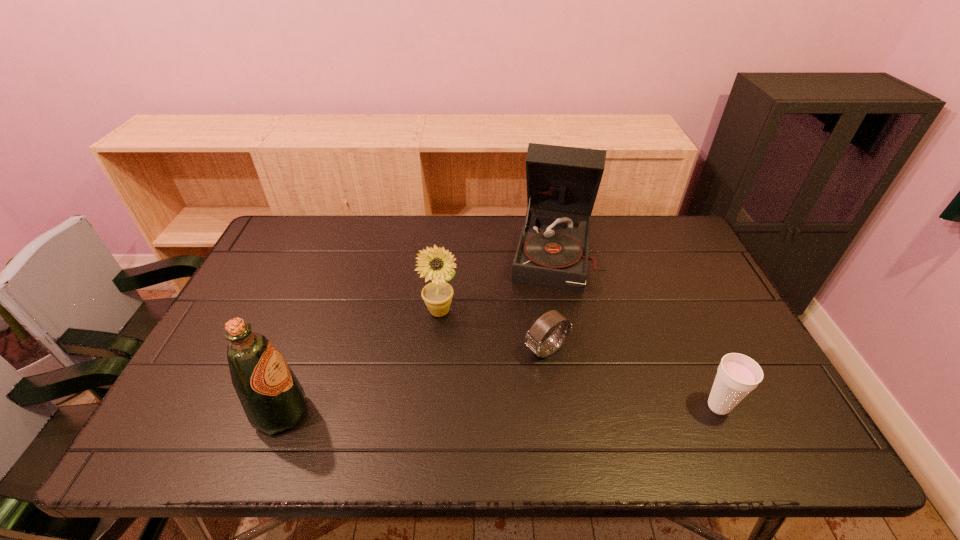
Find the location of `free space between the third nearest object and the leftmost object`. free space between the third nearest object and the leftmost object is located at coordinates (414, 381).

Where is `object that stands as the third closest to the third nearest object`? object that stands as the third closest to the third nearest object is located at coordinates (737, 375).

Identify the location of object that ranks as the third closest to the third tallest object. coord(273,399).

Find the location of a particular element. free space that satisfies the following two spatial constraints: 1. on the front side of the second shortest object; 2. on the left side of the sunflower is located at coordinates (431, 406).

You are a GUI agent. You are given a task and a screenshot of the screen. Output one action in this format:
    pyautogui.click(x=<x>, y=<y>)
    Task: Click on the vacant area in the image that satisfies the following two spatial constraints: 1. on the back side of the third tallest object; 2. on the left side of the tallest object
    This screenshot has width=960, height=540.
    Given the screenshot: What is the action you would take?
    pyautogui.click(x=445, y=251)

Where is `vacant space that satisfies the following two spatial constraints: 1. on the front side of the fourth tallest object; 2. on the right side of the watch`? vacant space that satisfies the following two spatial constraints: 1. on the front side of the fourth tallest object; 2. on the right side of the watch is located at coordinates (555, 406).